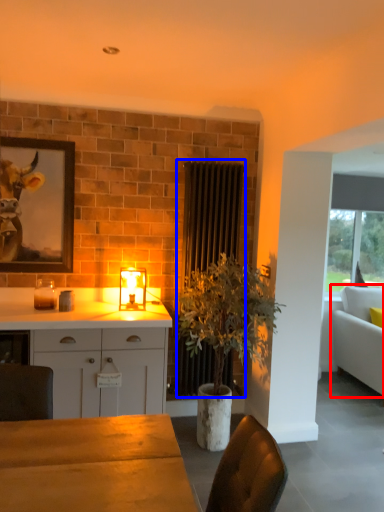
Question: Which object is closer to the camera taking this photo, studio couch (highlighted by a red box) or radiator (highlighted by a blue box)?

Choices:
 (A) studio couch
 (B) radiator

Answer: (B)